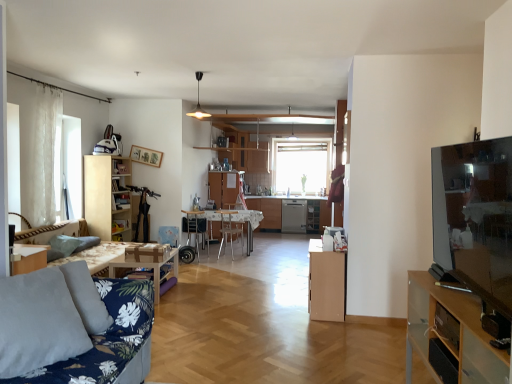
Question: Is light brown wood cabinet at center, which is the second cabinetry from right to left, positioned with its back to wooden picture frame at upper center?

Choices:
 (A) yes
 (B) no

Answer: (B)

Question: Can you confirm if light brown wood cabinet at center, the second cabinetry viewed from the back, is bigger than wooden picture frame at upper center?

Choices:
 (A) no
 (B) yes

Answer: (B)

Question: Is light brown wood cabinet at center, which is the second cabinetry from right to left, smaller than wooden picture frame at upper center?

Choices:
 (A) no
 (B) yes

Answer: (A)

Question: Would you say wooden picture frame at upper center is part of light brown wood cabinet at center, which is counted as the 2th cabinetry, starting from the front,'s contents?

Choices:
 (A) yes
 (B) no

Answer: (B)

Question: Is light brown wood cabinet at center, which is counted as the 2th cabinetry, starting from the front, placed right next to wooden picture frame at upper center?

Choices:
 (A) no
 (B) yes

Answer: (A)

Question: From the image's perspective, is light brown wood cabinet at center, the second cabinetry viewed from the left, below wooden picture frame at upper center?

Choices:
 (A) no
 (B) yes

Answer: (B)

Question: Does light brown wood cabinet at center, the second cabinetry viewed from the back, have a lesser width compared to white sheer curtain at left?

Choices:
 (A) yes
 (B) no

Answer: (B)

Question: Is white sheer curtain at left a part of light brown wood cabinet at center, the second cabinetry viewed from the back?

Choices:
 (A) no
 (B) yes

Answer: (A)

Question: Does light brown wood cabinet at center, the second cabinetry viewed from the left, have a larger size compared to white sheer curtain at left?

Choices:
 (A) yes
 (B) no

Answer: (A)

Question: From a real-world perspective, is light brown wood cabinet at center, which is the second cabinetry from right to left, below white sheer curtain at left?

Choices:
 (A) no
 (B) yes

Answer: (B)

Question: Is light brown wood cabinet at center, which is the second cabinetry from right to left, completely or partially outside of white sheer curtain at left?

Choices:
 (A) yes
 (B) no

Answer: (A)

Question: From the image's perspective, does light brown wood cabinet at center, which is counted as the 2th cabinetry, starting from the front, appear lower than white sheer curtain at left?

Choices:
 (A) no
 (B) yes

Answer: (B)

Question: Is green fabric pillow at lower left thinner than light brown wood cabinet at center, the second cabinetry viewed from the left?

Choices:
 (A) no
 (B) yes

Answer: (B)